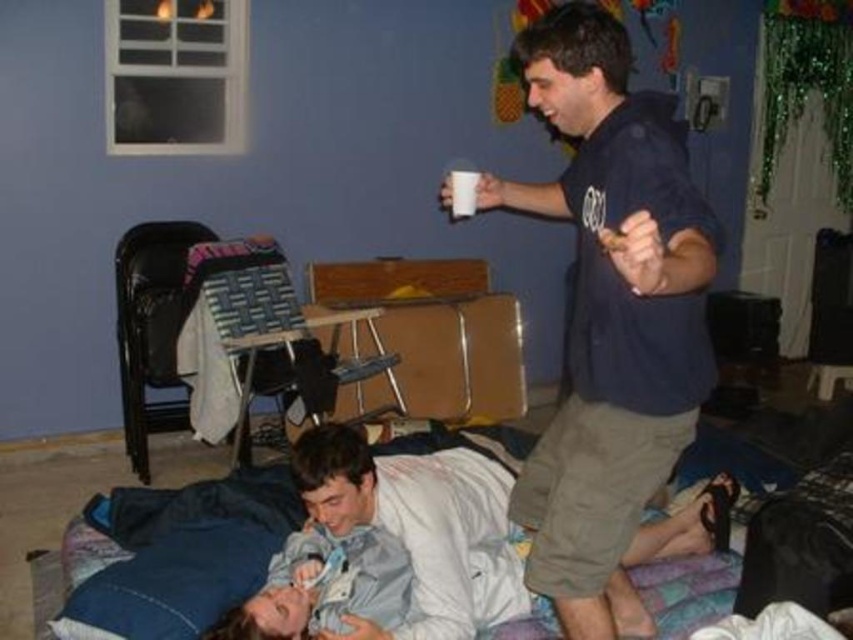
You are trying to decide whether to place a rectangular box on either the dark blue shirt at upper right or the denim fabric bed at lower center. Based on their thickness, which surface can better support the box without bending?

The denim fabric bed at lower center is thicker than the dark blue shirt at upper right, so it can better support the box without bending.

You are a photographer setting up for a photoshoot in this room. You need to position a light source between the dark blue shirt at upper right and the denim fabric bed at lower center. Can you place it exactly halfway between them?

The dark blue shirt at upper right and denim fabric bed at lower center are 63.64 centimeters apart. Half of that distance is 31.82 centimeters. Place the light source 31.82 centimeters from either object to position it exactly halfway between them.